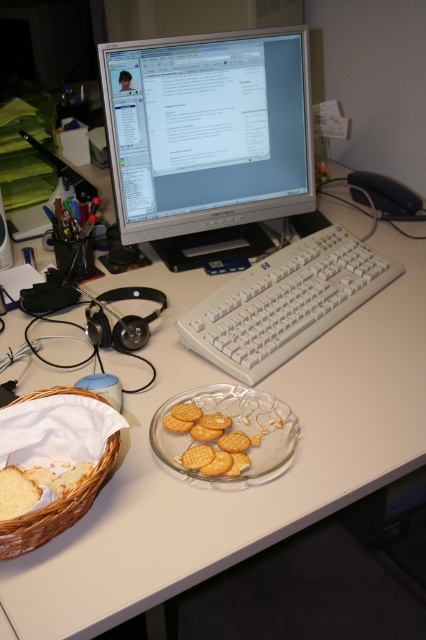
Is satin silver monitor at upper center further to the viewer compared to white plastic keyboard at center?

That is True.

Can you confirm if satin silver monitor at upper center is wider than white plastic keyboard at center?

Incorrect, satin silver monitor at upper center's width does not surpass white plastic keyboard at center's.

The image size is (426, 640). In order to click on satin silver monitor at upper center in this screenshot , I will do `click(207, 140)`.

Consider the image. How distant is white plastic keyboard at center from woven brown basket at lower left?

white plastic keyboard at center and woven brown basket at lower left are 17.78 inches apart.

Between white plastic keyboard at center and woven brown basket at lower left, which one has less height?

woven brown basket at lower left

Find the location of `white plastic keyboard at center`. white plastic keyboard at center is located at coordinates click(284, 301).

Between satin silver monitor at upper center and golden crisp crackers at center, which one appears on the left side from the viewer's perspective?

From the viewer's perspective, satin silver monitor at upper center appears more on the left side.

Can you confirm if satin silver monitor at upper center is positioned above golden crisp crackers at center?

Yes, satin silver monitor at upper center is above golden crisp crackers at center.

Measure the distance between satin silver monitor at upper center and camera.

satin silver monitor at upper center is 1.07 meters away from camera.

The image size is (426, 640). In order to click on satin silver monitor at upper center in this screenshot , I will do `click(207, 140)`.